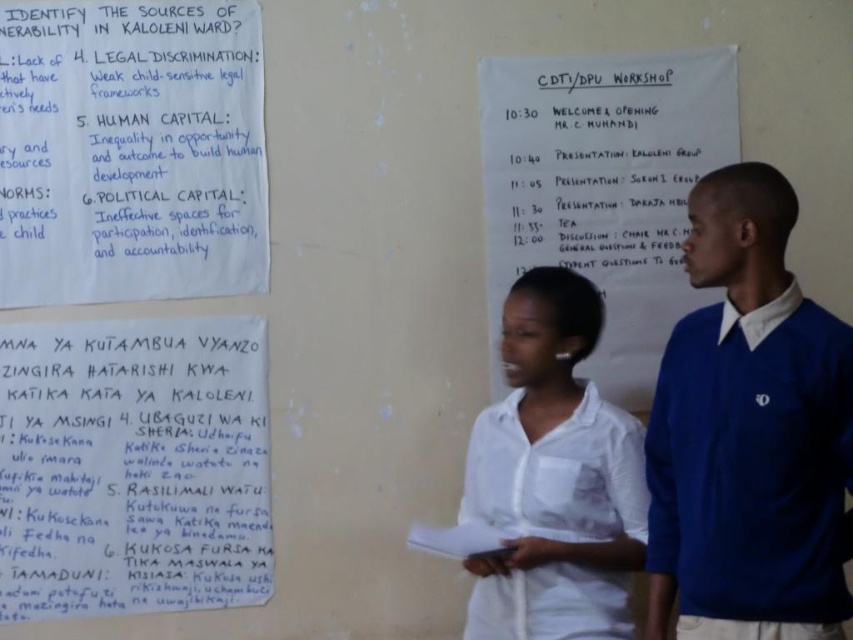
You are organizing a meeting in this workshop and need to ensure that all materials are visible to participants. The handwritten paper at center and the white paper at center are both important. Which paper is covering the other one?

The handwritten paper at center is positioned under white paper at center, so the white paper at center is covering the handwritten paper at center.

You are organizing a presentation and need to ensure that all materials fit on the table. The table can only accommodate items up to the size of the white cotton shirt at center. Will the handwritten paper at center fit on the table?

The handwritten paper at center is larger than the white cotton shirt at center, so it will not fit on the table which can only accommodate items up to the size of the white cotton shirt at center.

You are standing in the workshop and want to move from point A to point B. Point A is at coordinate point (820, 483) and point B is at coordinate point (712, 64). Which point is closer to you?

Result: Point A at coordinate point (820, 483) is closer to you than point B at coordinate point (712, 64).